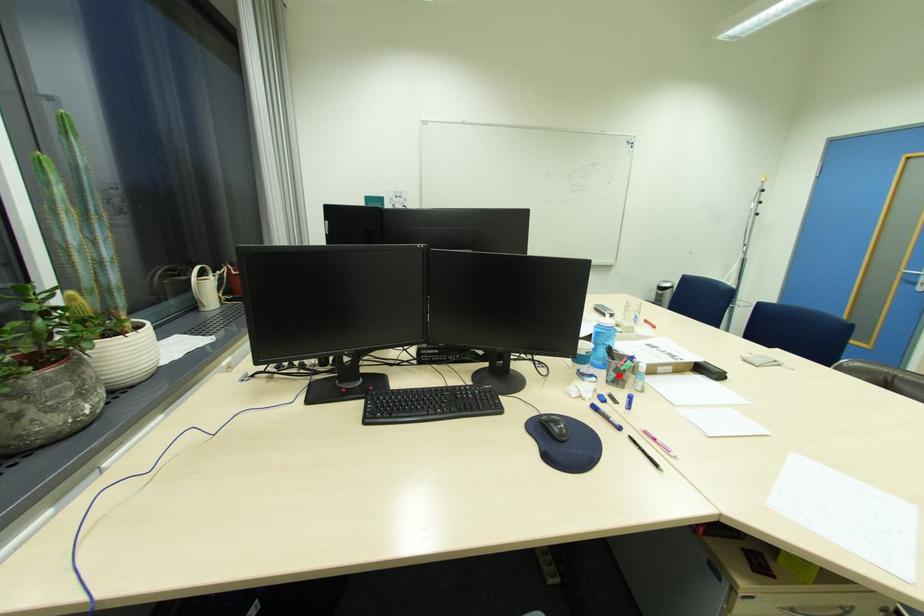
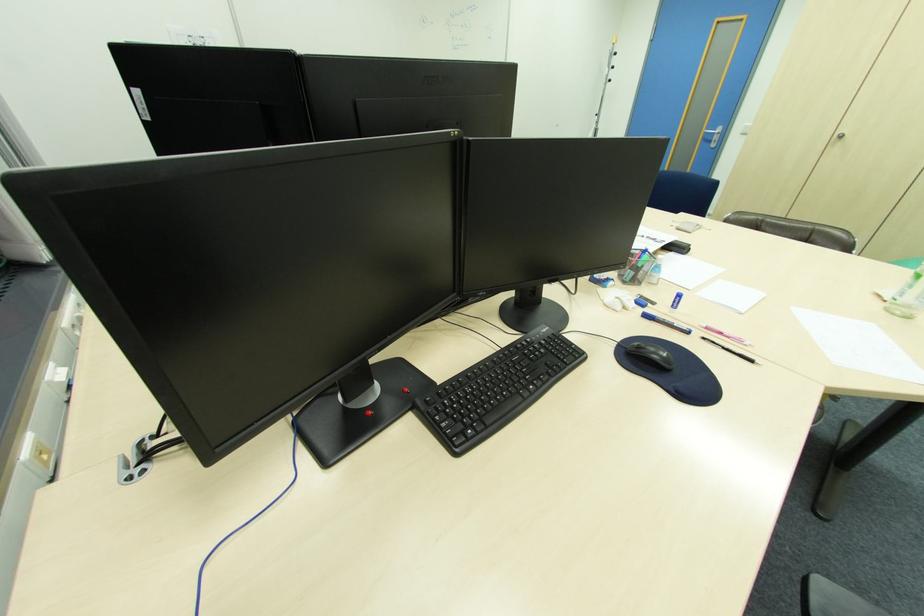
The point at the highlighted location is marked in the first image. Where is the corresponding point in the second image?

(637, 274)